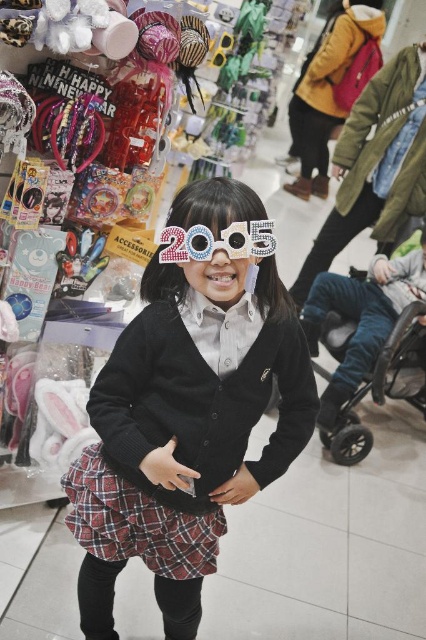
Question: Can you confirm if plaid fabric skirt at center is bigger than shiny metallic goggles at center?

Choices:
 (A) no
 (B) yes

Answer: (B)

Question: Estimate the real-world distances between objects in this image. Which object is closer to the shiny metallic goggles at center?

Choices:
 (A) black matte sweater at center
 (B) plaid fabric skirt at center

Answer: (A)

Question: Considering the real-world distances, which object is closest to the plaid fabric skirt at center?

Choices:
 (A) black matte sweater at center
 (B) shiny metallic goggles at center

Answer: (A)

Question: Does black matte sweater at center have a larger size compared to plaid fabric skirt at center?

Choices:
 (A) yes
 (B) no

Answer: (A)

Question: Which point is closer to the camera?

Choices:
 (A) shiny metallic goggles at center
 (B) black matte sweater at center

Answer: (A)

Question: Does plaid fabric skirt at center have a larger size compared to shiny metallic goggles at center?

Choices:
 (A) no
 (B) yes

Answer: (B)